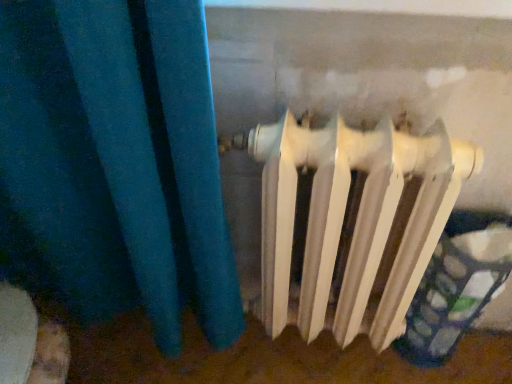
This screenshot has height=384, width=512. Describe the element at coordinates (352, 222) in the screenshot. I see `white matte radiator at center` at that location.

You are a GUI agent. You are given a task and a screenshot of the screen. Output one action in this format:
    pyautogui.click(x=<x>, y=<y>)
    Task: Click on the white matte radiator at center
    This screenshot has width=512, height=384.
    Given the screenshot: What is the action you would take?
    pyautogui.click(x=352, y=222)

Where is `white matte radiator at center`? Image resolution: width=512 pixels, height=384 pixels. white matte radiator at center is located at coordinates (352, 222).